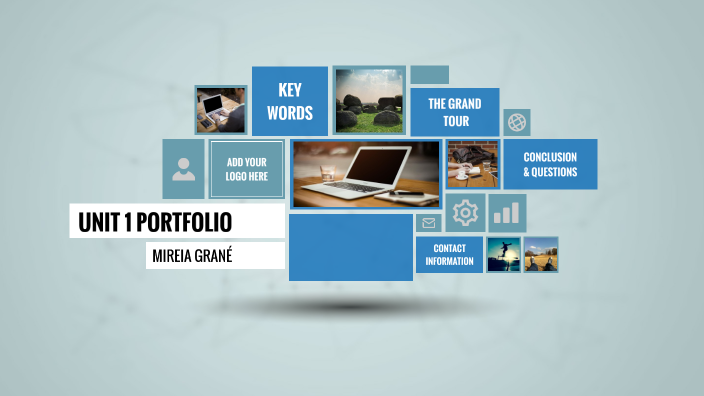
Where is `clip board`? Image resolution: width=704 pixels, height=396 pixels. clip board is located at coordinates (420, 203).